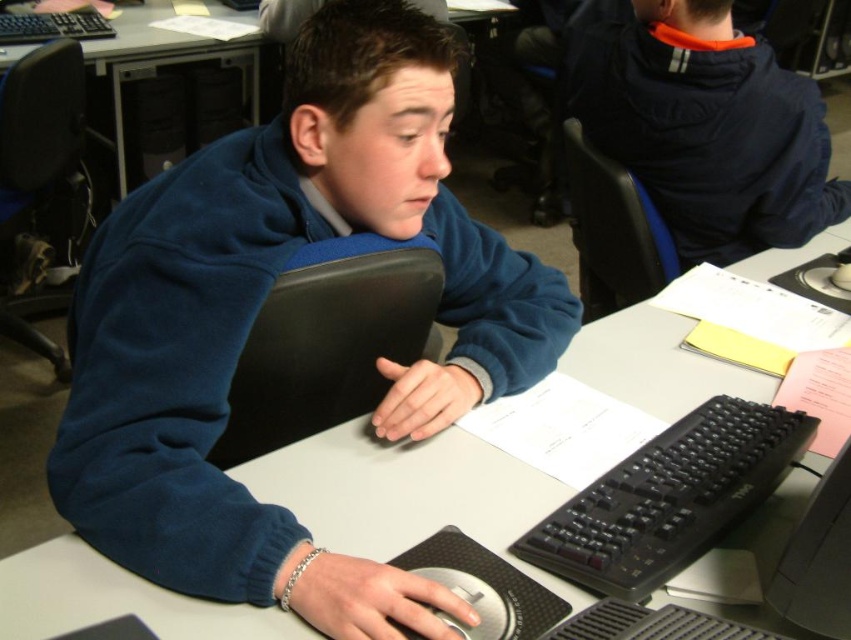
You are a student who wants to take a photo of the blue fleece jacket at center from your current position. Is the jacket within the typical 50 inches focal range of most standard cameras?

The blue fleece jacket at center is 27.45 inches away from the viewer, which is within the typical 50 inches focal range of most standard cameras, so yes, it can be photographed from this distance.

Based on the photo, you are standing in the classroom and want to reach the point marked at coordinates (x=657, y=412). Can you estimate how far you need to walk to get there?

The point marked at coordinates (x=657, y=412) is 3.51 feet away from the camera, so you need to walk approximately 3.51 feet to reach it.

You are a student in the classroom and need to place a book between the black plastic keyboard at center and the black plastic keyboard at upper left. Which keyboard should you place the book closer to if you want the book to be closer to the taller keyboard?

→ The black plastic keyboard at center is much taller than the black plastic keyboard at upper left, so place the book closer to the black plastic keyboard at center to be near the taller one.